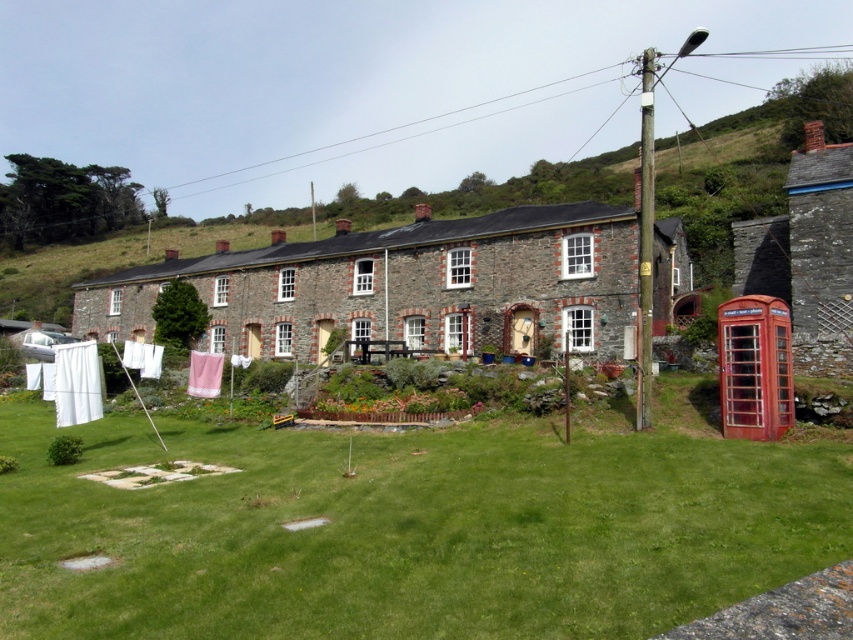
You are standing in front of the stone building and want to walk towards the green grass at lower center. Which direction should you move to reach it without passing through the rustic stone cottage at center?

The green grass at lower center is closer to the viewer than the rustic stone cottage at center, so you should move forward towards it directly since it is in front of the cottage.

You are standing at the entrance of the stone building and want to walk towards the point labeled as point (82, 292). If you look towards your destination, which direction would the point labeled point (270, 467) be relative to your path?

Point (270, 467) is in front of point (82, 292), so if you are walking towards point (82, 292), the point (270, 467) would be behind you relative to your path.

You are planning to place a new garden ornament that requires a space of 2 square meters. Given the green grass at lower center and the rustic stone cottage at center, which area can accommodate the ornament?

The rustic stone cottage at center has a larger size than the green grass at lower center, so the ornament can be placed there.